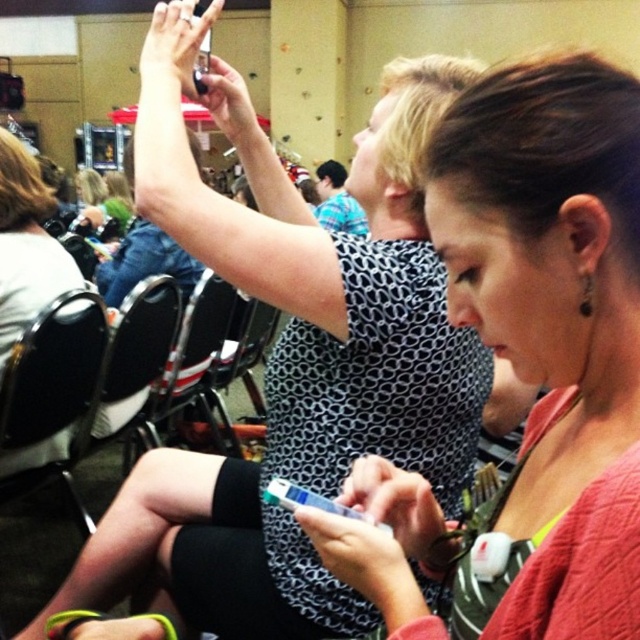
Question: Does pink textured sweater at center lie in front of black fabric chair at center?

Choices:
 (A) yes
 (B) no

Answer: (A)

Question: Which point is farther from the camera taking this photo?

Choices:
 (A) (595, 86)
 (B) (58, 433)

Answer: (B)

Question: Estimate the real-world distances between objects in this image. Which object is farther from the matte black chair at left?

Choices:
 (A) pink textured sweater at center
 (B) black fabric chair at center

Answer: (A)

Question: Can you confirm if matte black chair at left is smaller than black fabric chair at center?

Choices:
 (A) no
 (B) yes

Answer: (B)

Question: Which object appears farthest from the camera in this image?

Choices:
 (A) black fabric chair at center
 (B) matte black chair at left

Answer: (A)

Question: Can you confirm if pink textured sweater at center is wider than black fabric chair at center?

Choices:
 (A) yes
 (B) no

Answer: (B)